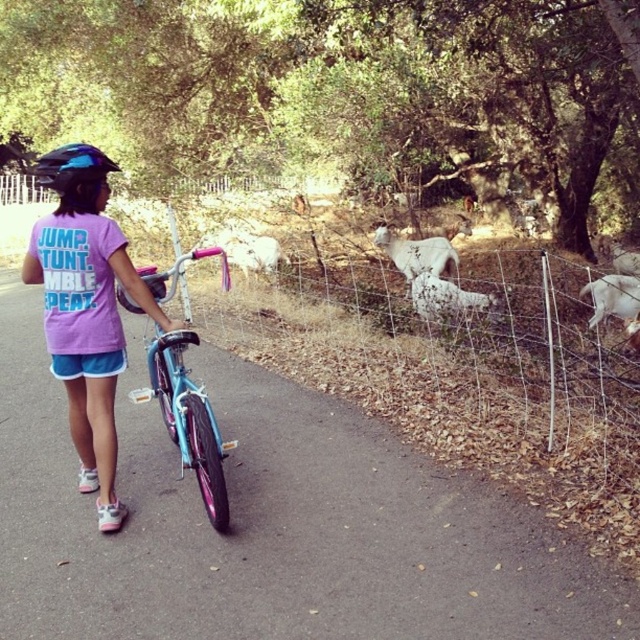
You are a photographer trying to capture the blue matte helmet at upper left and the white woolen sheep at center in the same frame. Based on their positions, which object will appear larger in the photo?

The blue matte helmet at upper left appears closer to the camera than the white woolen sheep at center, so the blue matte helmet at upper left will look larger in the photo.

In the scene shown: You are a photographer trying to capture the scene. You want to focus on both the point at coordinates point (419, 314) and the point at coordinates point (54, 163). Which point is closer to your camera?

Point (54, 163) is closer to the camera because it is less further than point (419, 314).

You are a photographer trying to capture the pink fabric shirt at center and the blue matte helmet at upper left in the same frame. Which object should you focus on first to ensure both are in focus?

The pink fabric shirt at center is closer to the viewer than the blue matte helmet at upper left, so you should focus on the pink fabric shirt at center first to ensure both are in focus.